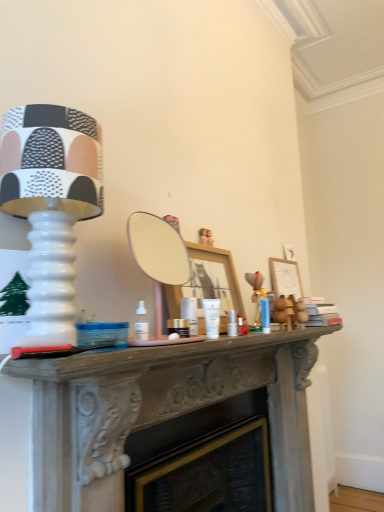
At what (x,y) coordinates should I click in order to perform the action: click on smooth gray mantelpiece at center. Please return your answer as a coordinate pair (x, y). The height and width of the screenshot is (512, 384). Looking at the image, I should click on (162, 411).

What do you see at coordinates (51, 203) in the screenshot? Image resolution: width=384 pixels, height=512 pixels. I see `matte white lamp at left` at bounding box center [51, 203].

The image size is (384, 512). I want to click on wooden picture frame at right, so click(285, 277).

From a real-world perspective, is matte white lamp at left located beneath wooden picture frame at right?

No.

Which of these two, matte white lamp at left or wooden picture frame at right, is smaller?

wooden picture frame at right.

Looking at this image, is matte white lamp at left not close to wooden picture frame at right?

Yes, matte white lamp at left and wooden picture frame at right are quite far apart.

From a real-world perspective, is matte white lamp at left physically located above or below smooth gray mantelpiece at center?

matte white lamp at left is situated higher than smooth gray mantelpiece at center in the real world.

Consider the image. Could you tell me if matte white lamp at left is turned towards smooth gray mantelpiece at center?

No, matte white lamp at left does not turn towards smooth gray mantelpiece at center.

From the image's perspective, is matte white lamp at left above smooth gray mantelpiece at center?

Indeed, from the image's perspective, matte white lamp at left is shown above smooth gray mantelpiece at center.

Is matte white lamp at left taller or shorter than smooth gray mantelpiece at center?

matte white lamp at left is shorter than smooth gray mantelpiece at center.

Consider the image. From the image's perspective, does white glossy cream at center appear higher than smooth gray mantelpiece at center?

Yes, from the image's perspective, white glossy cream at center is over smooth gray mantelpiece at center.

Could you tell me if white glossy cream at center is facing smooth gray mantelpiece at center?

No.

Between point (235, 333) and point (49, 456), which one is positioned behind?

The point (235, 333) is farther.

Is smooth gray mantelpiece at center aimed at matte white lamp at left?

No, smooth gray mantelpiece at center is not oriented towards matte white lamp at left.

Between smooth gray mantelpiece at center and matte white lamp at left, which one is positioned in front?

Positioned in front is matte white lamp at left.

From a real-world perspective, is smooth gray mantelpiece at center located higher than matte white lamp at left?

No, from a real-world perspective, smooth gray mantelpiece at center is not on top of matte white lamp at left.

Which point is more forward, (x=100, y=503) or (x=278, y=269)?

The point (x=100, y=503) is closer.

Does smooth gray mantelpiece at center turn towards wooden picture frame at right?

No, smooth gray mantelpiece at center is not oriented towards wooden picture frame at right.

Where is `table in front of the wooden picture frame at right`? The width and height of the screenshot is (384, 512). table in front of the wooden picture frame at right is located at coordinates (162, 411).

Considering the sizes of smooth gray mantelpiece at center and wooden picture frame at right in the image, is smooth gray mantelpiece at center bigger or smaller than wooden picture frame at right?

Clearly, smooth gray mantelpiece at center is larger in size than wooden picture frame at right.

Consider the image. From a real-world perspective, who is located lower, wooden picture frame at right or smooth gray mantelpiece at center?

smooth gray mantelpiece at center.

Who is bigger, wooden picture frame at right or smooth gray mantelpiece at center?

smooth gray mantelpiece at center.

Could smooth gray mantelpiece at center be considered to be inside wooden picture frame at right?

No, smooth gray mantelpiece at center is not inside wooden picture frame at right.

From the image's perspective, which is below, wooden picture frame at right or smooth gray mantelpiece at center?

smooth gray mantelpiece at center appears lower in the image.

Does wooden picture frame at right lie in front of white glossy cream at center?

No.

Considering the positions of points (281, 285) and (235, 320), is point (281, 285) farther from camera compared to point (235, 320)?

Yes, point (281, 285) is behind point (235, 320).

In the image, is wooden picture frame at right on the left side or the right side of white glossy cream at center?

Clearly, wooden picture frame at right is on the right of white glossy cream at center in the image.

Can you tell me how much wooden picture frame at right and white glossy cream at center differ in facing direction?

The angular difference between wooden picture frame at right and white glossy cream at center is 4.6 degrees.

The image size is (384, 512). Find the location of `table lamp above the wooden picture frame at right (from the image's perspective)`. table lamp above the wooden picture frame at right (from the image's perspective) is located at coordinates (51, 203).

The height and width of the screenshot is (512, 384). Identify the location of table behind the matte white lamp at left. (162, 411).

When comparing their distances from wooden picture frame at right, does smooth gray mantelpiece at center or white glossy cream at center seem further?

white glossy cream at center is positioned further to the anchor wooden picture frame at right.

Looking at the image, which one is located further to matte white lamp at left, wooden picture frame at right or white glossy cream at center?

wooden picture frame at right is further to matte white lamp at left.

Which object lies nearer to the anchor point wooden picture frame at right, matte white lamp at left or smooth gray mantelpiece at center?

smooth gray mantelpiece at center.

When comparing their distances from smooth gray mantelpiece at center, does matte white lamp at left or white glossy cream at center seem closer?

white glossy cream at center is positioned closer to the anchor smooth gray mantelpiece at center.

Based on their spatial positions, is smooth gray mantelpiece at center or matte white lamp at left closer to white glossy cream at center?

smooth gray mantelpiece at center lies closer to white glossy cream at center than the other object.

Considering their positions, is white glossy cream at center positioned closer to matte white lamp at left than wooden picture frame at right?

white glossy cream at center.

Looking at the image, which one is located further to smooth gray mantelpiece at center, matte white lamp at left or wooden picture frame at right?

wooden picture frame at right.

In the scene shown: Looking at the image, which one is located closer to white glossy cream at center, smooth gray mantelpiece at center or wooden picture frame at right?

Among the two, smooth gray mantelpiece at center is located nearer to white glossy cream at center.

Identify the location of toiletry between matte white lamp at left and smooth gray mantelpiece at center from top to bottom. Image resolution: width=384 pixels, height=512 pixels. (232, 324).

Where is `table located between matte white lamp at left and wooden picture frame at right in the depth direction`? This screenshot has height=512, width=384. table located between matte white lamp at left and wooden picture frame at right in the depth direction is located at coordinates (162, 411).

Identify the location of toiletry between matte white lamp at left and wooden picture frame at right in the front-back direction. This screenshot has width=384, height=512. (232, 324).

Identify the location of toiletry located between smooth gray mantelpiece at center and wooden picture frame at right in the depth direction. This screenshot has height=512, width=384. (232, 324).